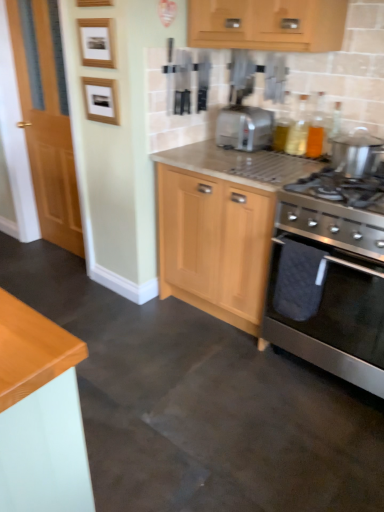
Identify the location of free spot in front of satin silver toaster at center. (242, 160).